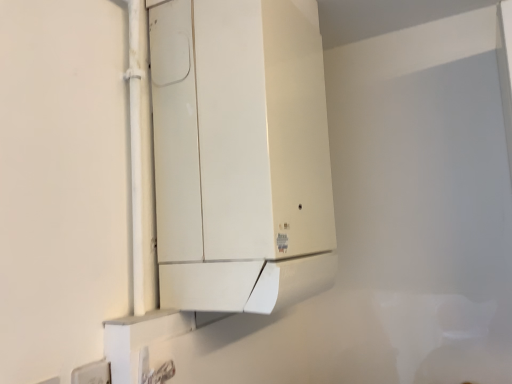
Question: Is white matte cabinet at center bigger or smaller than white plastic electric outlet at lower left?

Choices:
 (A) small
 (B) big

Answer: (B)

Question: Considering the positions of point (281, 256) and point (100, 362), is point (281, 256) closer or farther from the camera than point (100, 362)?

Choices:
 (A) farther
 (B) closer

Answer: (A)

Question: Is white matte cabinet at center spatially inside white plastic electric outlet at lower left, or outside of it?

Choices:
 (A) outside
 (B) inside

Answer: (A)

Question: From a real-world perspective, relative to white matte cabinet at center, is white plastic electric outlet at lower left vertically above or below?

Choices:
 (A) above
 (B) below

Answer: (B)

Question: Is white plastic electric outlet at lower left taller or shorter than white matte cabinet at center?

Choices:
 (A) tall
 (B) short

Answer: (B)

Question: Relative to white matte cabinet at center, is white plastic electric outlet at lower left in front or behind?

Choices:
 (A) front
 (B) behind

Answer: (A)

Question: In terms of width, does white plastic electric outlet at lower left look wider or thinner when compared to white matte cabinet at center?

Choices:
 (A) thin
 (B) wide

Answer: (A)